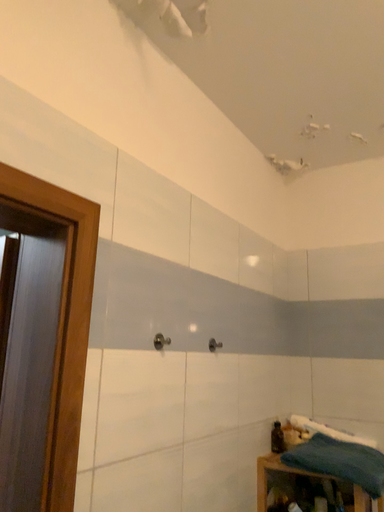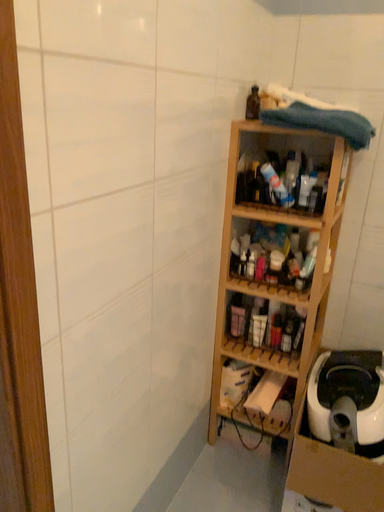
Question: Which way did the camera rotate in the video?

Choices:
 (A) rotated downward
 (B) rotated upward

Answer: (A)